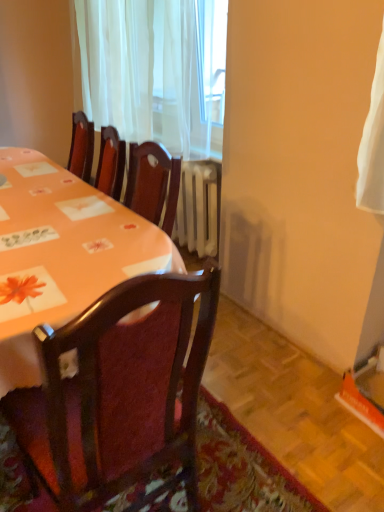
Question: From the image's perspective, is orange fabric table at upper left located beneath wooden chair at center?

Choices:
 (A) no
 (B) yes

Answer: (A)

Question: Can you confirm if orange fabric table at upper left is smaller than wooden chair at center?

Choices:
 (A) yes
 (B) no

Answer: (A)

Question: Is orange fabric table at upper left thinner than wooden chair at center?

Choices:
 (A) yes
 (B) no

Answer: (A)

Question: Is the surface of orange fabric table at upper left in direct contact with wooden chair at center?

Choices:
 (A) yes
 (B) no

Answer: (B)

Question: Considering the relative sizes of orange fabric table at upper left and wooden chair at center in the image provided, is orange fabric table at upper left shorter than wooden chair at center?

Choices:
 (A) no
 (B) yes

Answer: (B)

Question: Relative to orange fabric table at upper left, is white sheer curtain at upper center in front or behind?

Choices:
 (A) behind
 (B) front

Answer: (A)

Question: Based on their positions, is white sheer curtain at upper center located to the left or right of orange fabric table at upper left?

Choices:
 (A) right
 (B) left

Answer: (B)

Question: In terms of width, does white sheer curtain at upper center look wider or thinner when compared to orange fabric table at upper left?

Choices:
 (A) wide
 (B) thin

Answer: (B)

Question: From a real-world perspective, is white sheer curtain at upper center positioned above or below orange fabric table at upper left?

Choices:
 (A) above
 (B) below

Answer: (A)

Question: Is orange fabric table at upper left bigger or smaller than white sheer curtain at upper center?

Choices:
 (A) big
 (B) small

Answer: (B)

Question: In terms of height, does orange fabric table at upper left look taller or shorter compared to white sheer curtain at upper center?

Choices:
 (A) tall
 (B) short

Answer: (B)

Question: From a real-world perspective, is orange fabric table at upper left above or below white sheer curtain at upper center?

Choices:
 (A) above
 (B) below

Answer: (B)

Question: In the image, is orange fabric table at upper left positioned in front of or behind white sheer curtain at upper center?

Choices:
 (A) front
 (B) behind

Answer: (A)

Question: From a real-world perspective, relative to white sheer curtain at upper center, is wooden chair at center vertically above or below?

Choices:
 (A) below
 (B) above

Answer: (A)

Question: Would you say wooden chair at center is inside or outside white sheer curtain at upper center?

Choices:
 (A) inside
 (B) outside

Answer: (B)